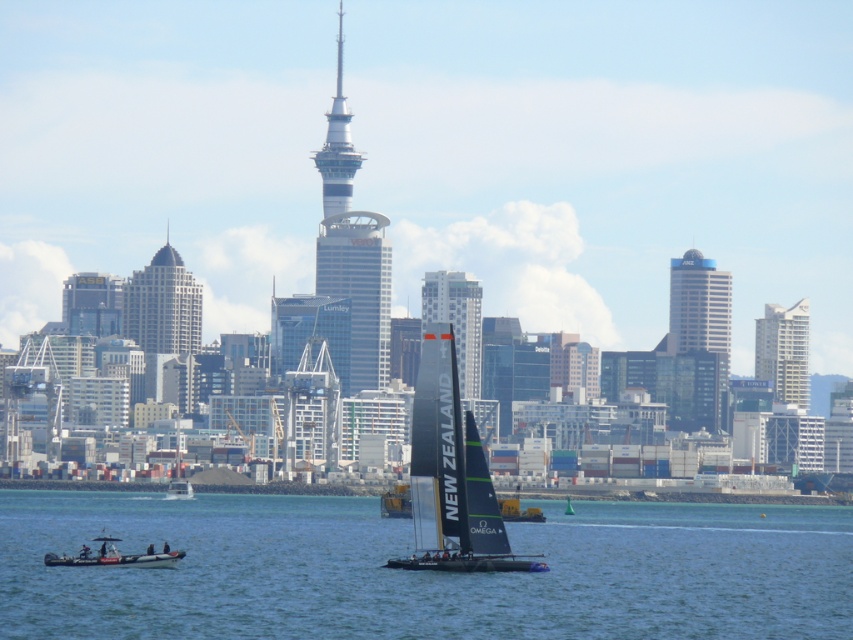
Between blue glass skyscraper at center and white glass skyscraper at center, which one is positioned higher?

white glass skyscraper at center

This screenshot has width=853, height=640. I want to click on blue glass skyscraper at center, so click(x=701, y=314).

Does point (376, 314) lie behind point (786, 392)?

No, it is not.

Does point (339, 289) lie behind point (787, 323)?

No, (339, 289) is closer to viewer.

This screenshot has width=853, height=640. I want to click on glassy blue skyscraper at center, so click(358, 289).

Describe the element at coordinates (457, 320) in the screenshot. I see `white glass skyscraper at center` at that location.

Is white glass skyscraper at center taller than white glass building at upper right?

Indeed, white glass skyscraper at center has a greater height compared to white glass building at upper right.

From the picture: Who is more forward, [462,381] or [792,392]?

Point [462,381] is in front.

I want to click on white glass skyscraper at center, so click(x=457, y=320).